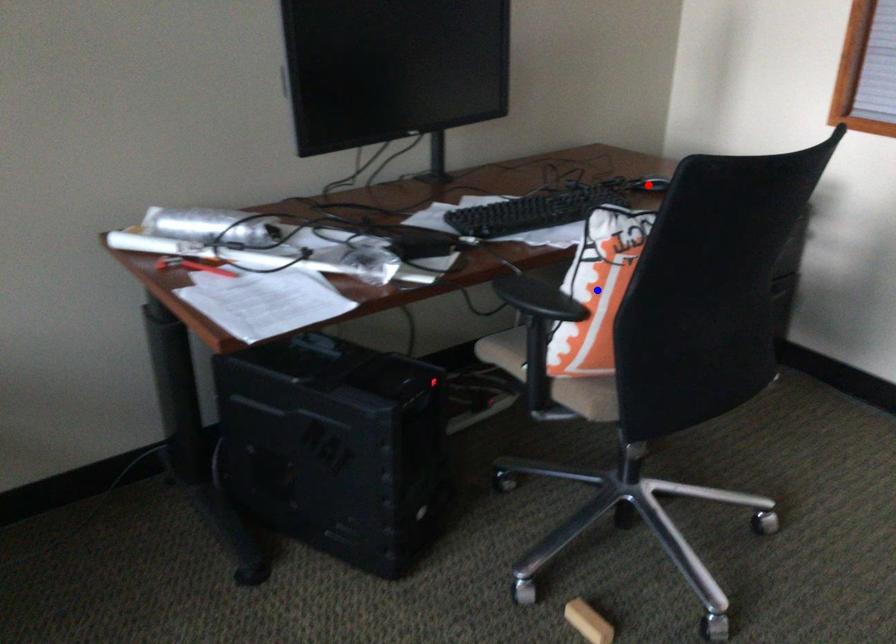
Question: Which of the two points in the image is closer to the camera?

Choices:
 (A) Blue point is closer.
 (B) Red point is closer.

Answer: (A)